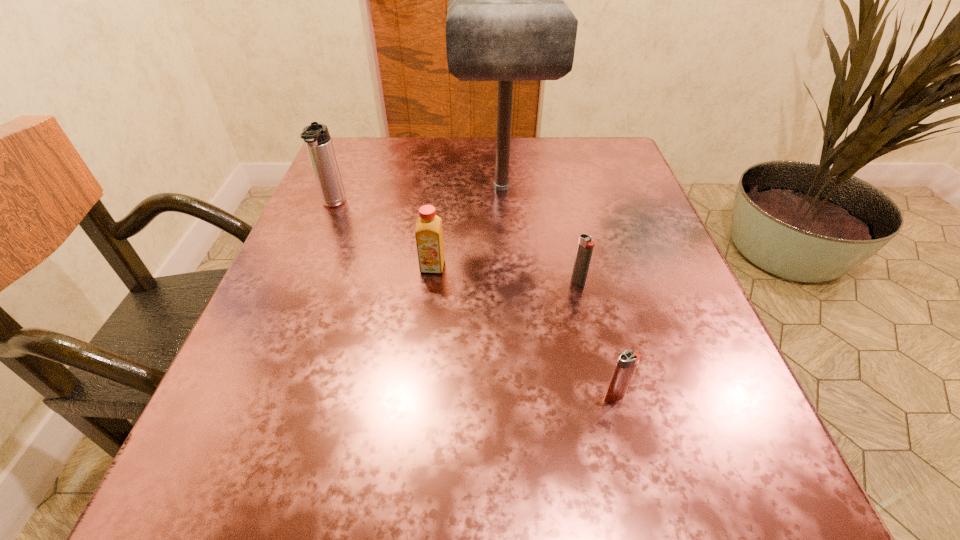
At what (x,y) coordinates should I click in order to perform the action: click on the tallest object. Please return your answer as a coordinate pair (x, y). The image size is (960, 540). Looking at the image, I should click on (507, 20).

Identify the location of mallet. (507, 20).

Where is `the second tallest object`? The width and height of the screenshot is (960, 540). the second tallest object is located at coordinates (316, 136).

The image size is (960, 540). In order to click on the leftmost object in this screenshot , I will do [316, 136].

The image size is (960, 540). Identify the location of orange juice. (429, 235).

Where is `the third farthest object`? the third farthest object is located at coordinates (429, 235).

Identify the location of the farther igniter. This screenshot has height=540, width=960. (585, 247).

You are a GUI agent. You are given a task and a screenshot of the screen. Output one action in this format:
    pyautogui.click(x=<x>, y=<y>)
    Task: Click on the nearer igniter
    
    Given the screenshot: What is the action you would take?
    pyautogui.click(x=627, y=361)

Image resolution: width=960 pixels, height=540 pixels. What are the coordinates of `vacant space located 0.090m on the front of the third object from right to left` in the screenshot? It's located at (505, 232).

Locate an element on the screen. This screenshot has width=960, height=540. free spot located 0.060m on the handle side of the leftmost object is located at coordinates (321, 234).